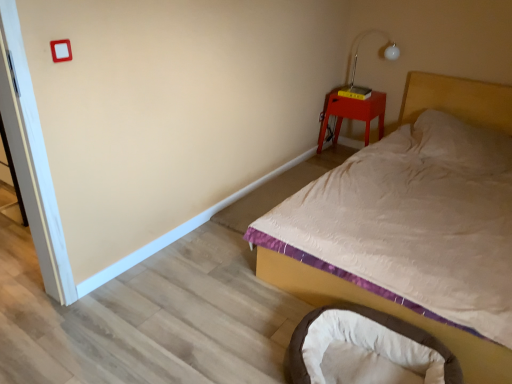
Question: Based on their sizes in the image, would you say matte red wooden nightstand at upper right is bigger or smaller than white quilted fabric bed at upper right?

Choices:
 (A) big
 (B) small

Answer: (B)

Question: From a real-world perspective, is matte red wooden nightstand at upper right positioned above or below white quilted fabric bed at upper right?

Choices:
 (A) below
 (B) above

Answer: (A)

Question: Which of these objects is positioned farthest from the white quilted fabric bed at upper right?

Choices:
 (A) metallic silver table lamp at upper right
 (B) brown plush infant bed at lower right
 (C) matte red wooden nightstand at upper right

Answer: (A)

Question: Which is nearer to the metallic silver table lamp at upper right?

Choices:
 (A) matte red wooden nightstand at upper right
 (B) white quilted fabric bed at upper right
 (C) brown plush infant bed at lower right

Answer: (A)